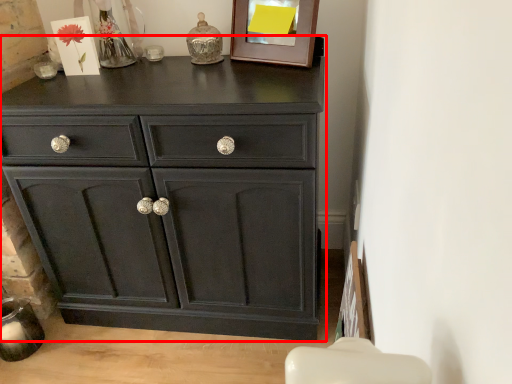
Question: Where is chest of drawers (annotated by the red box) located in relation to picture frame in the image?

Choices:
 (A) left
 (B) right

Answer: (A)